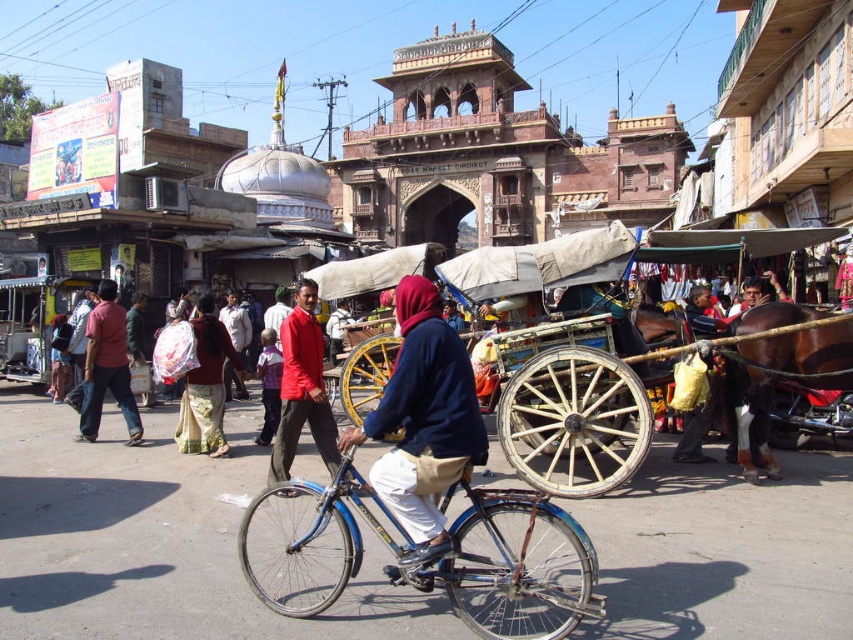
Looking at this image, you are a photographer standing at the camera position in the scene. You want to take a photo of the brown glossy horse at right. The camera has a maximum focus range of 150 feet. Will the horse be in focus?

The brown glossy horse at right is 142.72 feet away from the camera, which is within the maximum focus range of 150 feet. Therefore, the horse will be in focus.

You are standing at the entrance of the market and see the wooden cart at center and the red matte jacket at center. Which object is closer to you?

The wooden cart at center is closer to you because it is positioned further to the viewer than the red matte jacket at center.

You are standing in the market area and want to take a photo of the ornate gateway. You notice two points marked in the scene. The first point is at coordinates point (746, 422), and the second point is at point (136, 422). Which of these points is closer to your camera when you take the photo?

Point (746, 422) is closer to the camera than point (136, 422).